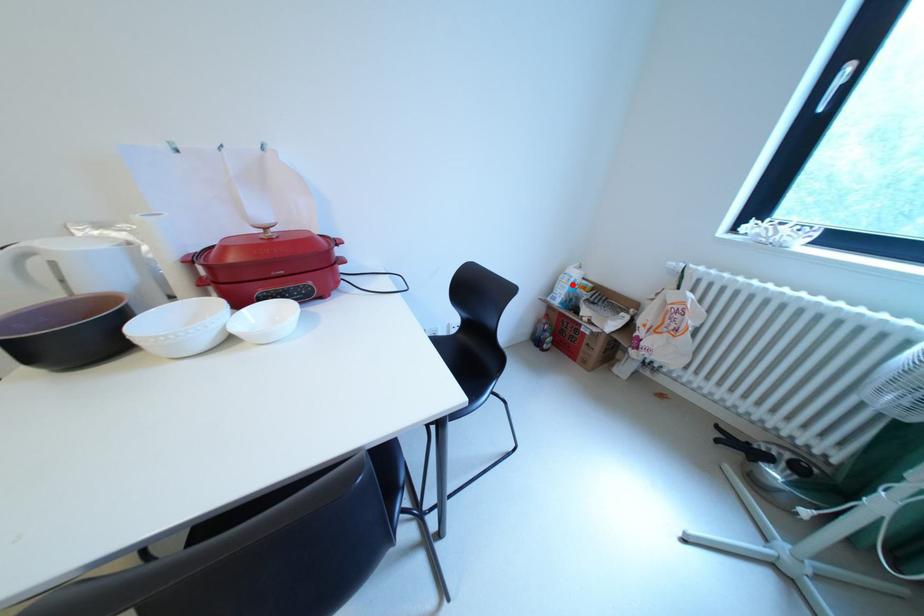
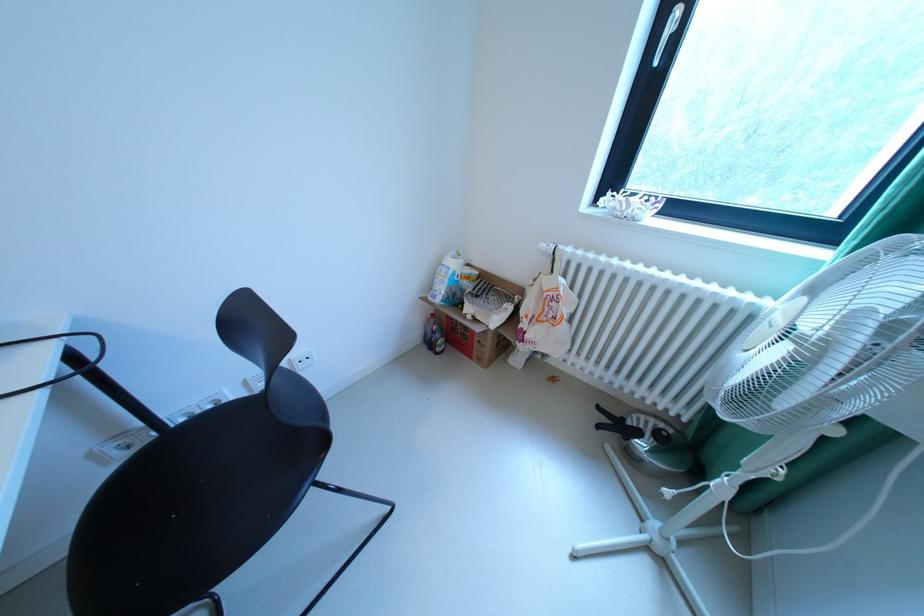
Find the pixel in the second image that matches the highlighted location in the first image.

(451, 278)